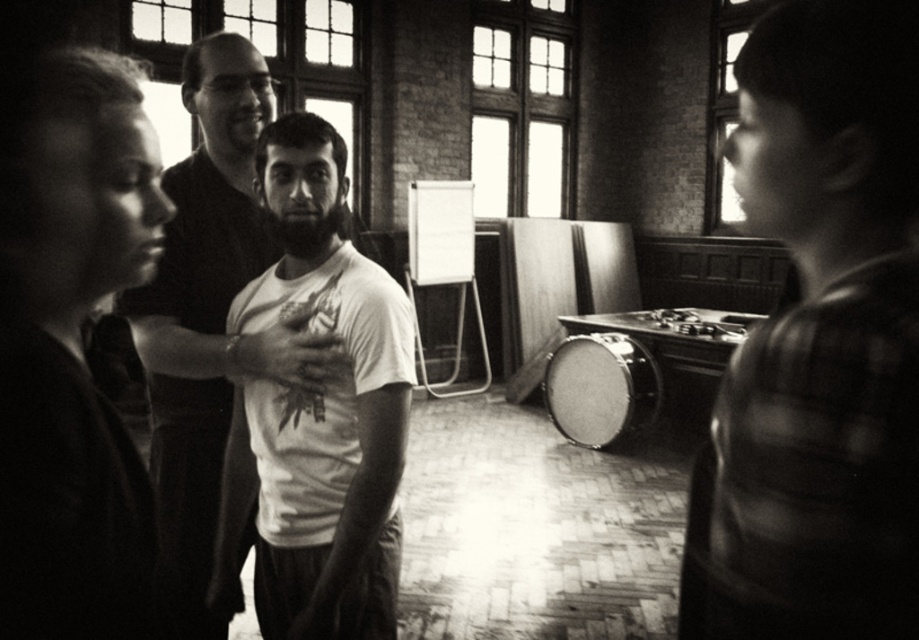
Can you confirm if plaid shirt at right is positioned above white matte t-shirt at center?

Yes, plaid shirt at right is above white matte t-shirt at center.

Is plaid shirt at right behind white matte t-shirt at center?

No, plaid shirt at right is closer to the viewer.

Where is `plaid shirt at right`? This screenshot has height=640, width=919. plaid shirt at right is located at coordinates (819, 342).

From the picture: Can you confirm if plaid shirt at right is smaller than smooth white t-shirt at center?

Correct, plaid shirt at right occupies less space than smooth white t-shirt at center.

Between plaid shirt at right and smooth white t-shirt at center, which one appears on the right side from the viewer's perspective?

Positioned to the right is plaid shirt at right.

Where is `plaid shirt at right`? This screenshot has width=919, height=640. plaid shirt at right is located at coordinates (819, 342).

Is plaid shirt at right to the right of smooth drum at center from the viewer's perspective?

Incorrect, plaid shirt at right is not on the right side of smooth drum at center.

Who is higher up, plaid shirt at right or smooth drum at center?

plaid shirt at right is above.

Describe the element at coordinates (819, 342) in the screenshot. This screenshot has width=919, height=640. I see `plaid shirt at right` at that location.

I want to click on plaid shirt at right, so click(819, 342).